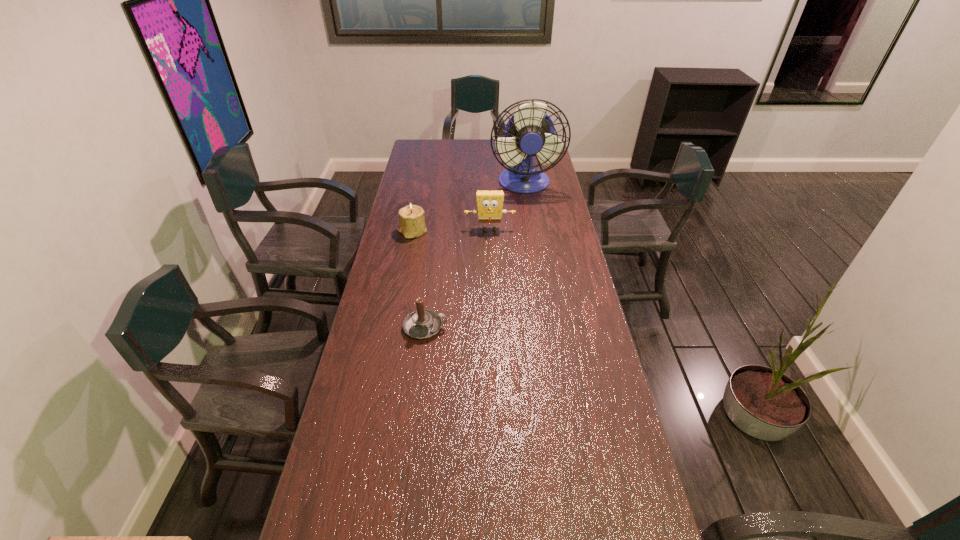
Where is `fan`? fan is located at coordinates [x=530, y=132].

I want to click on the tallest object, so click(x=530, y=132).

The height and width of the screenshot is (540, 960). Identify the location of sponge. (489, 203).

Locate an element on the screen. candle_holder is located at coordinates (412, 224).

You are a GUI agent. You are given a task and a screenshot of the screen. Output one action in this format:
    pyautogui.click(x=<x>, y=<y>)
    Task: Click on the nearest object
    
    Given the screenshot: What is the action you would take?
    pyautogui.click(x=421, y=324)

Where is `the shortest object`? This screenshot has width=960, height=540. the shortest object is located at coordinates (421, 324).

Locate an element on the screen. This screenshot has height=540, width=960. free point located in front of the farthest object where the airflow is directed is located at coordinates (532, 234).

Where is `free space located 0.210m on the face of the sponge`? This screenshot has height=540, width=960. free space located 0.210m on the face of the sponge is located at coordinates (491, 267).

Locate an element on the screen. This screenshot has height=540, width=960. free region located on the back of the candle_holder is located at coordinates (417, 211).

At what (x,y) coordinates should I click in order to perform the action: click on vacant space located on the side of the nearest object with the handle loop. Please return your answer as a coordinate pair (x, y). Looking at the image, I should click on (468, 327).